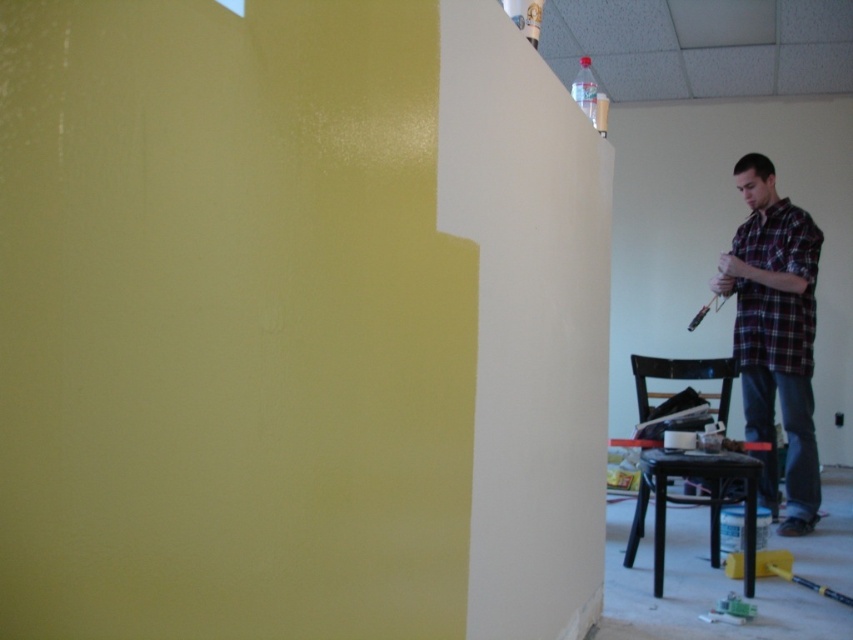
Can you confirm if plaid shirt at right is bigger than plaid cotton shirt at right?

Yes.

Find the location of a particular element. The image size is (853, 640). plaid shirt at right is located at coordinates (775, 326).

Who is more forward, (773, 378) or (805, 227)?

Positioned in front is point (805, 227).

Locate an element on the screen. This screenshot has width=853, height=640. plaid shirt at right is located at coordinates (775, 326).

Does point (782, 332) lie in front of point (625, 554)?

That is False.

Which of these two, plaid cotton shirt at right or matte black stool at lower right, stands shorter?

matte black stool at lower right

This screenshot has width=853, height=640. What are the coordinates of `plaid cotton shirt at right` in the screenshot? It's located at (776, 289).

Can you confirm if plaid shirt at right is positioned below matte black stool at lower right?

Result: Incorrect, plaid shirt at right is not positioned below matte black stool at lower right.

Is plaid shirt at right shorter than matte black stool at lower right?

In fact, plaid shirt at right may be taller than matte black stool at lower right.

Is point (798, 394) in front of point (641, 477)?

No, (798, 394) is further to viewer.

Locate an element on the screen. This screenshot has width=853, height=640. plaid shirt at right is located at coordinates (775, 326).